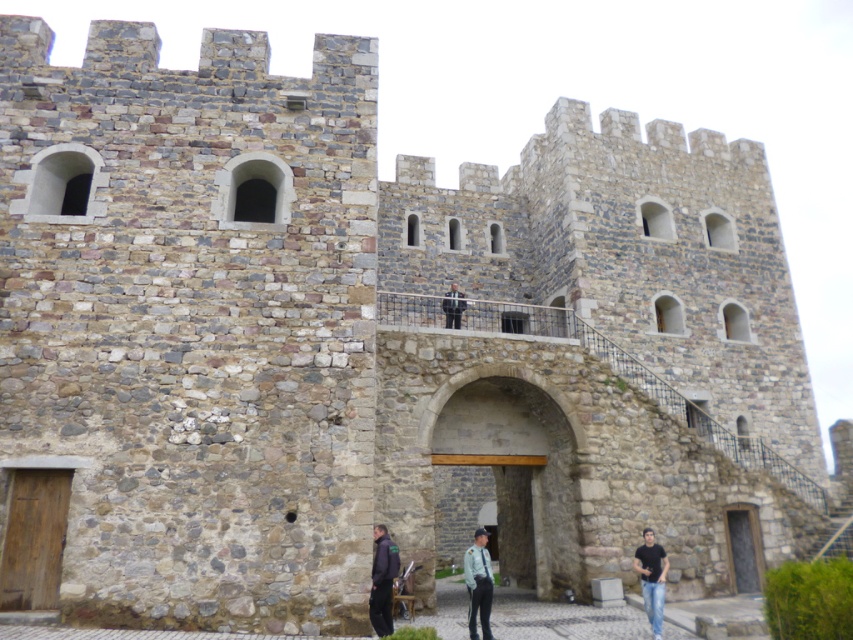
You are a guest at a formal event and see both the dark gray fabric jacket at lower center and the dark gray suit at center. Which one is positioned to the left?

The dark gray fabric jacket at lower center is positioned to the left of the dark gray suit at center.

You are a visitor at the castle and want to approach both the light blue uniform at center and the dark gray suit at center. Which one should you approach first to reach the other without going around the castle?

You should approach the light blue uniform at center first since it is closer to you than the dark gray suit at center, allowing you to reach the latter without needing to go around the castle.

You are a visitor approaching the castle entrance. You notice two people wearing dark gray fabric jacket at lower center and black matte shirt at lower right. Which person is standing nearer to you?

The dark gray fabric jacket at lower center is closer to the viewer than the black matte shirt at lower right, so the person wearing the dark gray fabric jacket at lower center is standing nearer to you.